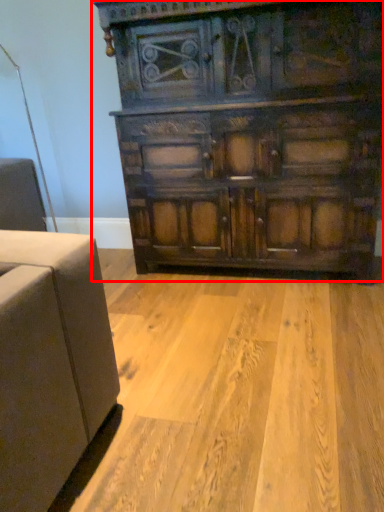
Question: Observing the image, what is the correct spatial positioning of chest of drawers (annotated by the red box) in reference to plywood?

Choices:
 (A) right
 (B) left

Answer: (A)